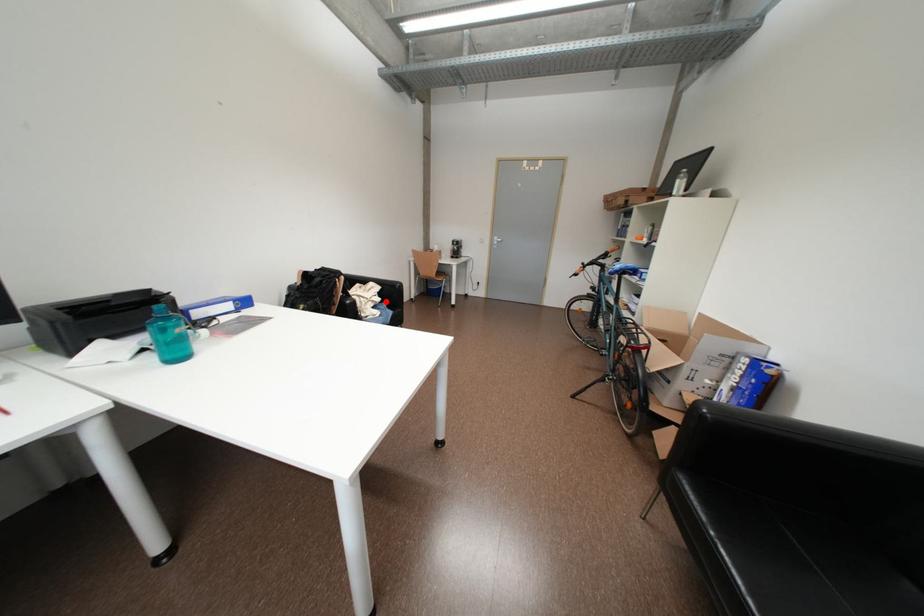
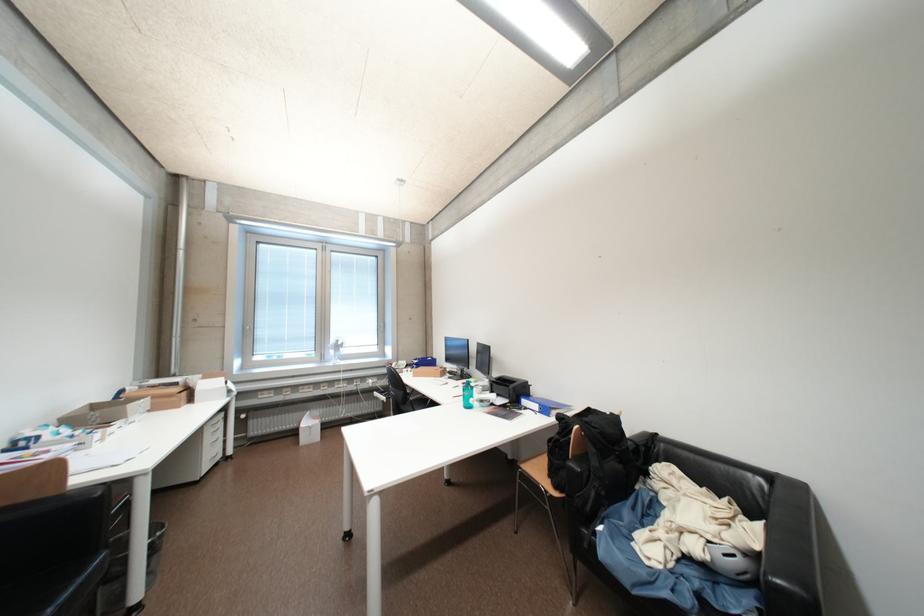
Locate, in the second image, the point that corresponds to the highlighted location in the first image.

(704, 551)